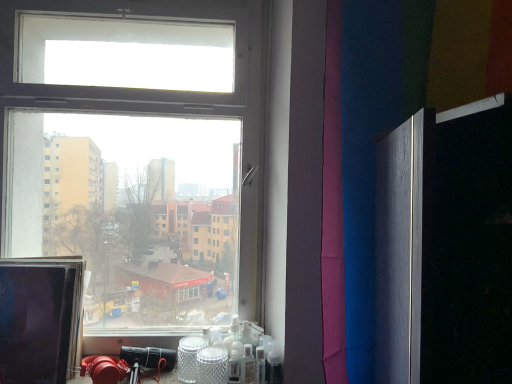
This screenshot has height=384, width=512. Describe the element at coordinates (39, 320) in the screenshot. I see `matte black monitor at left` at that location.

Identify the location of transparent glass window at center. pos(137,165).

This screenshot has width=512, height=384. What are the coordinates of `clear plastic spray bottle at lower center, the 1th toiletry when ordered from left to right` in the screenshot? It's located at (248, 366).

Is transparent glass window at center positioned beyond the bounds of purple fabric at right?

transparent glass window at center lies outside purple fabric at right's area.

Is transparent glass window at center facing away from purple fabric at right?

No.

From a real-world perspective, relative to purple fabric at right, is transparent glass window at center vertically above or below?

transparent glass window at center is above purple fabric at right.

Is the depth of transparent glass window at center greater than that of purple fabric at right?

Yes, the depth of transparent glass window at center is greater than that of purple fabric at right.

Where is `curtain above the translucent plastic spray bottle at lower right, which ranks as the 2th toiletry in left-to-right order (from the image's perspective)`? Image resolution: width=512 pixels, height=384 pixels. curtain above the translucent plastic spray bottle at lower right, which ranks as the 2th toiletry in left-to-right order (from the image's perspective) is located at coordinates (422, 186).

Is translucent plastic spray bottle at lower right, which ranks as the 2th toiletry in left-to-right order, wider or thinner than purple fabric at right?

Clearly, translucent plastic spray bottle at lower right, which ranks as the 2th toiletry in left-to-right order, has less width compared to purple fabric at right.

From the image's perspective, which one is positioned higher, translucent plastic spray bottle at lower right, which appears as the first toiletry when viewed from the right, or purple fabric at right?

purple fabric at right, from the image's perspective.

From the picture: Which object is positioned more to the left, translucent plastic spray bottle at lower right, which appears as the first toiletry when viewed from the right, or purple fabric at right?

Positioned to the left is translucent plastic spray bottle at lower right, which appears as the first toiletry when viewed from the right.

Is matte black monitor at left bigger or smaller than clear plastic spray bottle at lower center, the 1th toiletry when ordered from left to right?

In the image, matte black monitor at left appears to be larger than clear plastic spray bottle at lower center, the 1th toiletry when ordered from left to right.

Is matte black monitor at left taller than clear plastic spray bottle at lower center, acting as the 2th toiletry starting from the right?

Yes.

From the image's perspective, does matte black monitor at left appear lower than clear plastic spray bottle at lower center, the 1th toiletry when ordered from left to right?

No.

Based on the photo, in the image, is matte black monitor at left on the left side or the right side of clear plastic spray bottle at lower center, the 1th toiletry when ordered from left to right?

From the image, it's evident that matte black monitor at left is to the left of clear plastic spray bottle at lower center, the 1th toiletry when ordered from left to right.

Who is more distant, purple fabric at right or clear plastic spray bottle at lower center, the 1th toiletry when ordered from left to right?

Positioned behind is clear plastic spray bottle at lower center, the 1th toiletry when ordered from left to right.

Between purple fabric at right and clear plastic spray bottle at lower center, acting as the 2th toiletry starting from the right, which one has smaller width?

With smaller width is clear plastic spray bottle at lower center, acting as the 2th toiletry starting from the right.

Which is closer, (362,313) or (254,367)?

Point (362,313) is closer to the camera than point (254,367).

Considering the relative sizes of purple fabric at right and clear plastic spray bottle at lower center, acting as the 2th toiletry starting from the right, in the image provided, is purple fabric at right bigger than clear plastic spray bottle at lower center, acting as the 2th toiletry starting from the right,?

Yes.

Considering the relative sizes of translucent plastic spray bottle at lower right, which appears as the first toiletry when viewed from the right, and transparent glass window at center in the image provided, is translucent plastic spray bottle at lower right, which appears as the first toiletry when viewed from the right, thinner than transparent glass window at center?

Indeed, translucent plastic spray bottle at lower right, which appears as the first toiletry when viewed from the right, has a lesser width compared to transparent glass window at center.

From the image's perspective, which one is positioned higher, translucent plastic spray bottle at lower right, which ranks as the 2th toiletry in left-to-right order, or transparent glass window at center?

From the image's view, transparent glass window at center is above.

Does translucent plastic spray bottle at lower right, which appears as the first toiletry when viewed from the right, lie in front of transparent glass window at center?

That is False.

Based on the photo, from the image's perspective, is purple fabric at right located above or below translucent plastic spray bottle at lower right, which ranks as the 2th toiletry in left-to-right order?

purple fabric at right is situated higher than translucent plastic spray bottle at lower right, which ranks as the 2th toiletry in left-to-right order, in the image.

Does purple fabric at right appear on the left side of translucent plastic spray bottle at lower right, which appears as the first toiletry when viewed from the right?

No, purple fabric at right is not to the left of translucent plastic spray bottle at lower right, which appears as the first toiletry when viewed from the right.

Who is bigger, purple fabric at right or translucent plastic spray bottle at lower right, which appears as the first toiletry when viewed from the right?

purple fabric at right is bigger.

From a real-world perspective, is purple fabric at right on translucent plastic spray bottle at lower right, which appears as the first toiletry when viewed from the right?

Yes, from a real-world perspective, purple fabric at right is on top of translucent plastic spray bottle at lower right, which appears as the first toiletry when viewed from the right.

In the image, is transparent glass window at center on the left side or the right side of clear plastic spray bottle at lower center, acting as the 2th toiletry starting from the right?

From the image, it's evident that transparent glass window at center is to the left of clear plastic spray bottle at lower center, acting as the 2th toiletry starting from the right.

Looking at the image, does transparent glass window at center seem bigger or smaller compared to clear plastic spray bottle at lower center, the 1th toiletry when ordered from left to right?

Considering their sizes, transparent glass window at center takes up more space than clear plastic spray bottle at lower center, the 1th toiletry when ordered from left to right.

From a real-world perspective, does transparent glass window at center stand above clear plastic spray bottle at lower center, the 1th toiletry when ordered from left to right?

Yes, from a real-world perspective, transparent glass window at center is above clear plastic spray bottle at lower center, the 1th toiletry when ordered from left to right.

Locate an element on the screen. This screenshot has width=512, height=384. window above the purple fabric at right (from a real-world perspective) is located at coordinates (137, 165).

Find the location of a particular element. This screenshot has height=384, width=512. the 1st toiletry behind the purple fabric at right is located at coordinates (273, 363).

When comparing their distances from clear plastic spray bottle at lower center, acting as the 2th toiletry starting from the right, does matte black monitor at left or transparent glass window at center seem further?

transparent glass window at center is further to clear plastic spray bottle at lower center, acting as the 2th toiletry starting from the right.

Based on their spatial positions, is matte black monitor at left or transparent glass window at center closer to purple fabric at right?

transparent glass window at center is positioned closer to the anchor purple fabric at right.

Based on their spatial positions, is translucent plastic spray bottle at lower right, which appears as the first toiletry when viewed from the right, or transparent glass window at center further from purple fabric at right?

The object further to purple fabric at right is transparent glass window at center.

Which object lies further to the anchor point clear plastic spray bottle at lower center, acting as the 2th toiletry starting from the right, purple fabric at right or translucent plastic spray bottle at lower right, which ranks as the 2th toiletry in left-to-right order?

Based on the image, purple fabric at right appears to be further to clear plastic spray bottle at lower center, acting as the 2th toiletry starting from the right.

Considering their positions, is transparent glass window at center positioned closer to purple fabric at right than matte black monitor at left?

transparent glass window at center lies closer to purple fabric at right than the other object.

When comparing their distances from translucent plastic spray bottle at lower right, which ranks as the 2th toiletry in left-to-right order, does clear plastic spray bottle at lower center, acting as the 2th toiletry starting from the right, or purple fabric at right seem closer?

clear plastic spray bottle at lower center, acting as the 2th toiletry starting from the right, lies closer to translucent plastic spray bottle at lower right, which ranks as the 2th toiletry in left-to-right order, than the other object.

Looking at the image, which one is located further to matte black monitor at left, translucent plastic spray bottle at lower right, which ranks as the 2th toiletry in left-to-right order, or purple fabric at right?

purple fabric at right is positioned further to the anchor matte black monitor at left.

Considering their positions, is translucent plastic spray bottle at lower right, which ranks as the 2th toiletry in left-to-right order, positioned further to clear plastic spray bottle at lower center, acting as the 2th toiletry starting from the right, than matte black monitor at left?

Among the two, matte black monitor at left is located further to clear plastic spray bottle at lower center, acting as the 2th toiletry starting from the right.

Where is `toiletry that lies between purple fabric at right and clear plastic spray bottle at lower center, the 1th toiletry when ordered from left to right, from top to bottom`? The height and width of the screenshot is (384, 512). toiletry that lies between purple fabric at right and clear plastic spray bottle at lower center, the 1th toiletry when ordered from left to right, from top to bottom is located at coordinates 273,363.

Locate an element on the screen. window between matte black monitor at left and purple fabric at right is located at coordinates (137, 165).

Identify the location of toiletry between transparent glass window at center and clear plastic spray bottle at lower center, the 1th toiletry when ordered from left to right, from top to bottom. (273, 363).

Identify the location of window located between matte black monitor at left and translucent plastic spray bottle at lower right, which ranks as the 2th toiletry in left-to-right order, in the left-right direction. The image size is (512, 384). (137, 165).